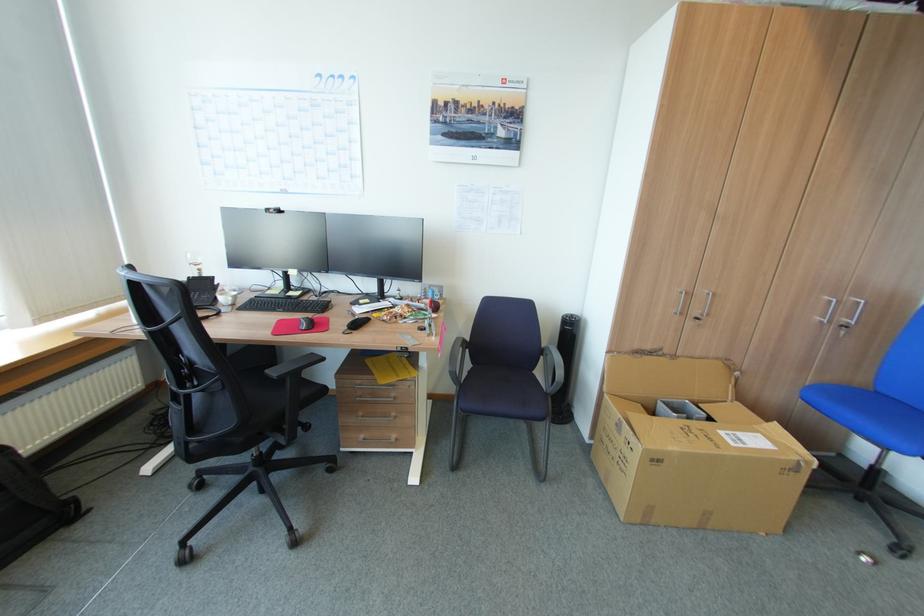
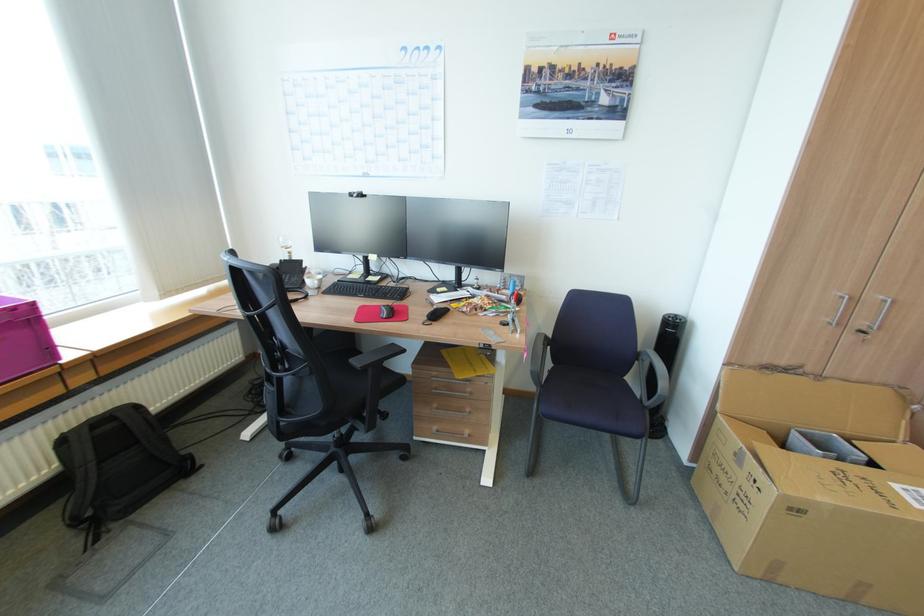
In the second image, find the point that corresponds to (663,461) in the first image.

(804, 511)